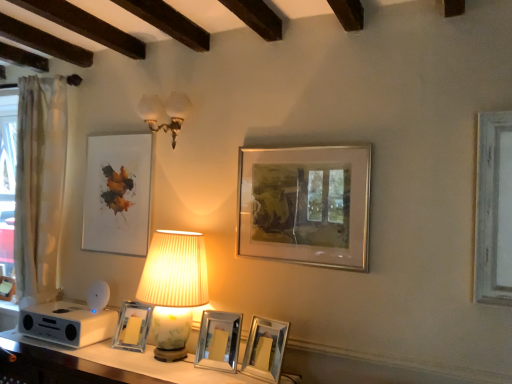
Find the location of a particular element. blank space to the left of clear glass photo frame at center, the second picture frame from the left is located at coordinates (99, 350).